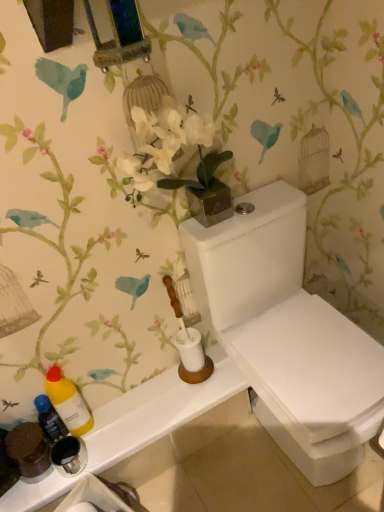
The image size is (384, 512). I want to click on vacant space in front of white ceramic toilet brush at center, so click(198, 395).